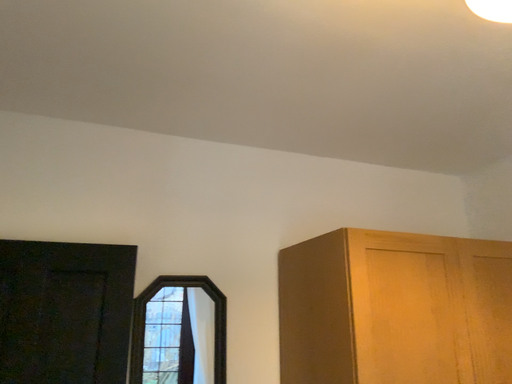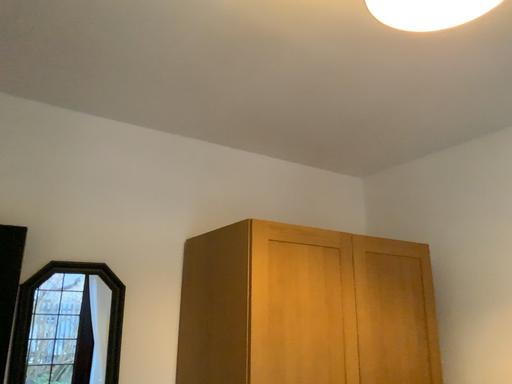
Question: Which way did the camera rotate in the video?

Choices:
 (A) rotated left
 (B) rotated right

Answer: (B)